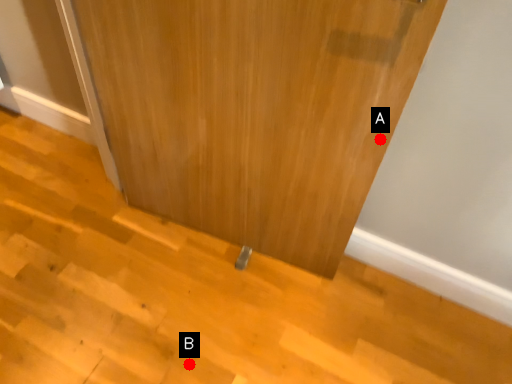
Question: Two points are circled on the image, labeled by A and B beside each circle. Which point appears closest to the camera in this image?

Choices:
 (A) A is closer
 (B) B is closer

Answer: (A)